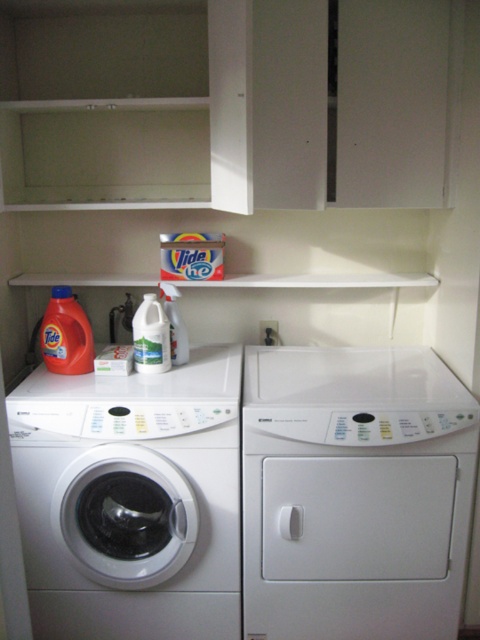
You are moving a 24 inch wide laundry basket into the laundry room. You want to place it between the white matte dryer at right and the white glossy jug at center. Is there enough space for the basket?

The distance between the white matte dryer at right and the white glossy jug at center is 25.47 inches. Since the laundry basket is 24 inches wide, there is enough space to place it between them as the available space is slightly larger than the basket.

You are trying to locate the matte orange detergent at lower left in the laundry room. According to the scene, where exactly is it positioned relative to the washing machine and dryer?

The matte orange detergent at lower left is located at point coordinates 0.523 on the x axis and 0.138 on the y axis relative to the washing machine and dryer.

You are moving a 24 inch wide cleaning spray bottle into the laundry room. You want to place it near the white matte dryer at right without blocking the clear plastic bottle at center. Is there enough space between them to fit the spray bottle?

The distance between the white matte dryer at right and the clear plastic bottle at center is 26.62 inches. Since the spray bottle is 24 inches wide, there is enough space to place it between them without blocking the clear plastic bottle at center.